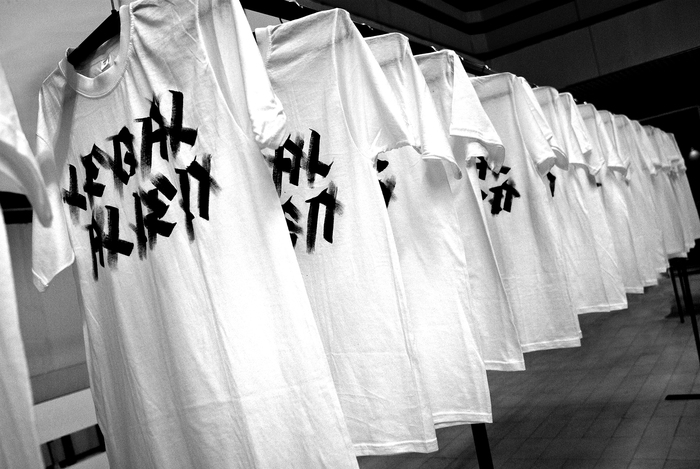
Locate an element on the screen. Image resolution: width=700 pixels, height=469 pixels. stands is located at coordinates (691, 310), (676, 291), (483, 438).